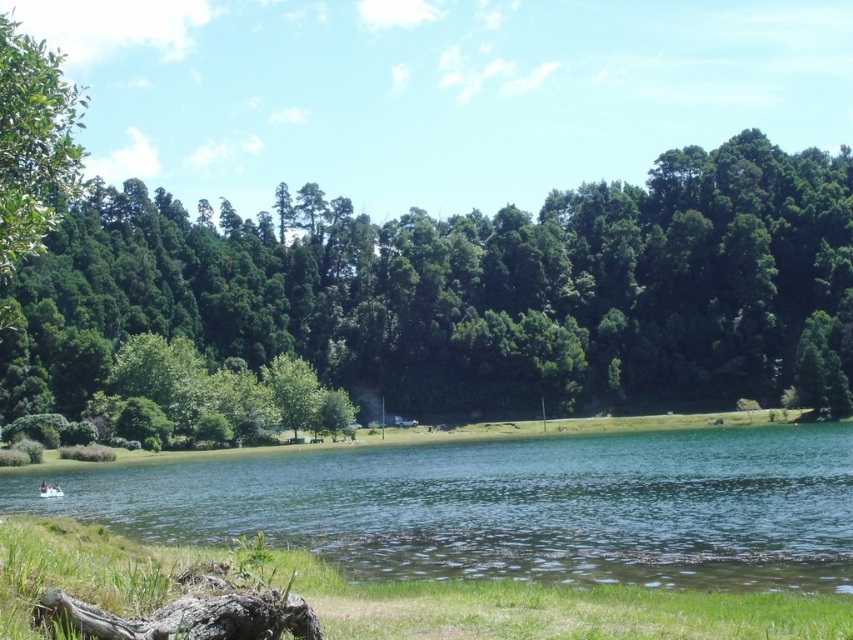
Is point (773, 618) farther from viewer compared to point (47, 488)?

That is False.

Locate an element on the screen. This screenshot has height=640, width=853. green grass at lower center is located at coordinates (549, 609).

Is point (815, 502) positioned after point (645, 605)?

Yes, it is behind point (645, 605).

Which is behind, point (804, 561) or point (712, 609)?

Point (804, 561)

At what (x,y) coordinates should I click in order to perform the action: click on green liquid water at center. Please return your answer as a coordinate pair (x, y). This screenshot has width=853, height=640. Looking at the image, I should click on (506, 506).

Who is lower down, green leafy tree at center or charcoal gray bark log at lower left?

charcoal gray bark log at lower left is below.

Looking at this image, which is more to the right, green leafy tree at center or charcoal gray bark log at lower left?

Positioned to the right is green leafy tree at center.

What do you see at coordinates (465, 289) in the screenshot?
I see `green leafy tree at center` at bounding box center [465, 289].

This screenshot has height=640, width=853. In order to click on green leafy tree at center in this screenshot , I will do `click(465, 289)`.